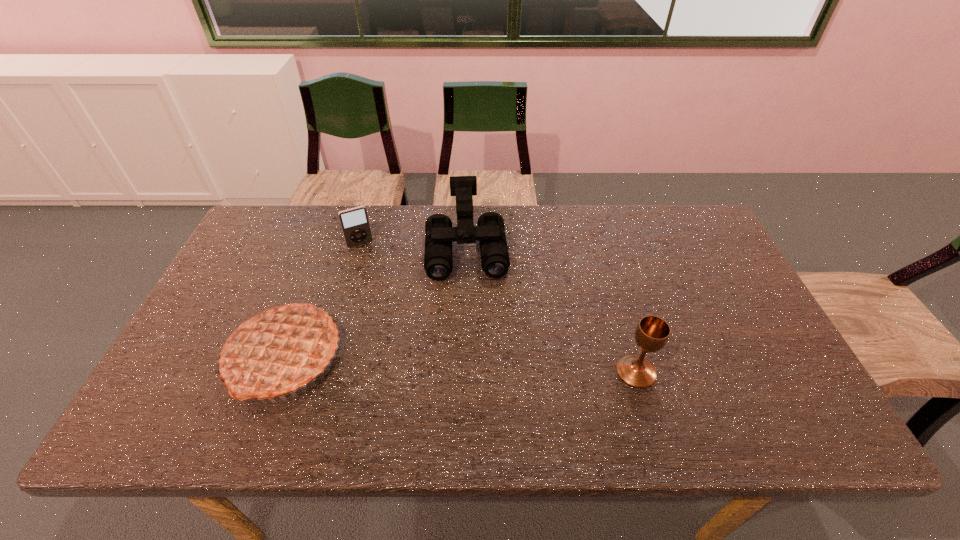
Locate an element on the screen. The image size is (960, 540). vacant space that is in between the binoculars and the shortest object is located at coordinates (413, 247).

You are a GUI agent. You are given a task and a screenshot of the screen. Output one action in this format:
    pyautogui.click(x=<x>, y=<y>)
    Task: Click on the free point between the iPod and the rightmost object
    This screenshot has width=960, height=540.
    Given the screenshot: What is the action you would take?
    pyautogui.click(x=498, y=308)

You are a GUI agent. You are given a task and a screenshot of the screen. Output one action in this format:
    pyautogui.click(x=<x>, y=<y>)
    Task: Click on the free space between the rightmost object and the pie
    
    Given the screenshot: What is the action you would take?
    pyautogui.click(x=461, y=364)

You are a GUI agent. You are given a task and a screenshot of the screen. Output one action in this format:
    pyautogui.click(x=<x>, y=<y>)
    Task: Click on the vacant area that lies between the binoculars and the tallest object
    
    Given the screenshot: What is the action you would take?
    pyautogui.click(x=375, y=303)

Identify which object is located as the third nearest to the pie. Please provide its 2D coordinates. Your answer should be formatted as a tuple, i.e. [(x, y)], where the tuple contains the x and y coordinates of a point satisfying the conditions above.

[(652, 333)]

Choose which object is the third nearest neighbor to the chalice. Please provide its 2D coordinates. Your answer should be formatted as a tuple, i.e. [(x, y)], where the tuple contains the x and y coordinates of a point satisfying the conditions above.

[(354, 222)]